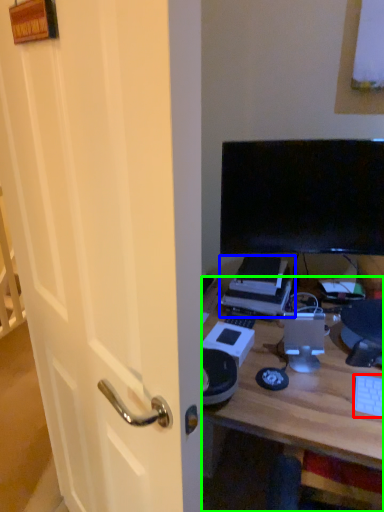
Question: Which is farther away from computer keyboard (highlighted by a red box)? printer (highlighted by a blue box) or desk (highlighted by a green box)?

Choices:
 (A) printer
 (B) desk

Answer: (A)